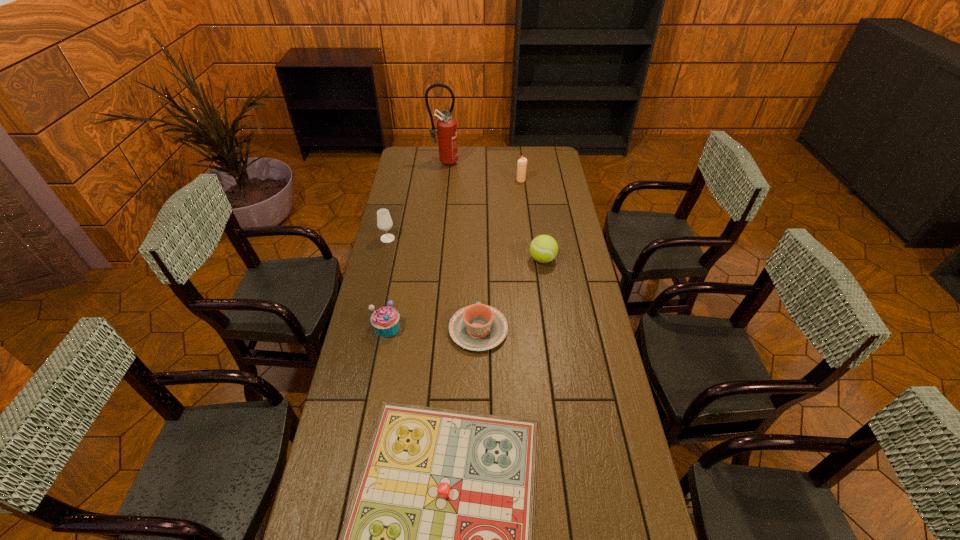
Locate an element on the screen. Image resolution: width=960 pixels, height=540 pixels. fire extinguisher is located at coordinates (446, 125).

Locate an element on the screen. the tallest object is located at coordinates (446, 125).

Where is `candle`? candle is located at coordinates (522, 162).

Where is `glass`? The image size is (960, 540). glass is located at coordinates (384, 222).

This screenshot has height=540, width=960. Find the location of `tennis ball`. tennis ball is located at coordinates (544, 248).

At what (x,y) coordinates should I click in order to perform the action: click on muffin. Please return your answer as a coordinate pair (x, y). This screenshot has height=540, width=960. Looking at the image, I should click on (385, 320).

Identify the location of the sixth tallest object. (477, 327).

The image size is (960, 540). Identify the location of vacant space located 0.180m at the nozzle of the fire extinguisher. (442, 187).

Find the location of a particular element. The width and height of the screenshot is (960, 540). blank space located 0.370m on the left of the sixth nearest object is located at coordinates (442, 180).

Identify the location of vacant space situated on the front of the third farthest object. (377, 284).